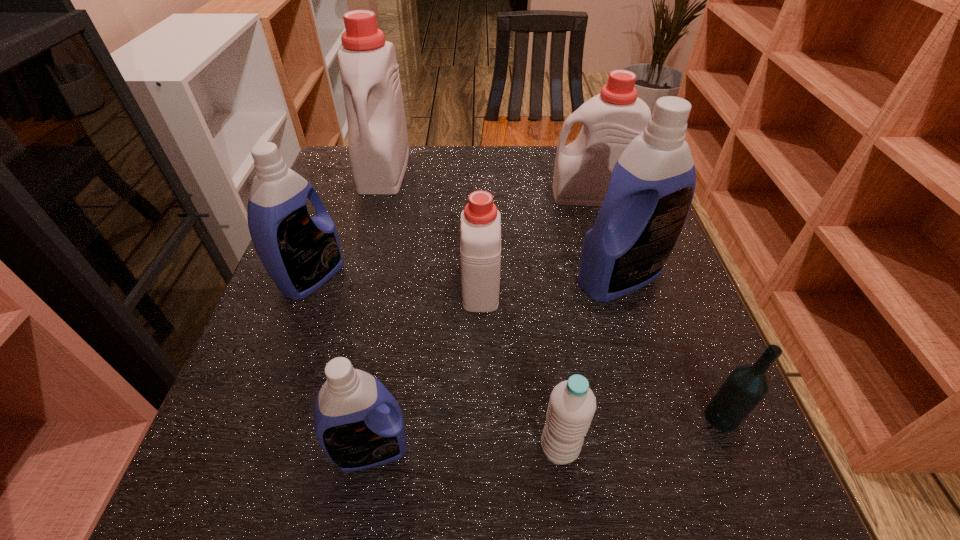
This screenshot has width=960, height=540. I want to click on vacant area at the left edge of the desktop, so click(315, 350).

Locate an element on the screen. vacant space at the right edge of the desktop is located at coordinates (652, 306).

Identify the location of vacant space at the far left corner of the desktop. (334, 176).

Image resolution: width=960 pixels, height=540 pixels. I want to click on vacant point located between the rightmost white detergent and the fourth object from left to right, so click(x=536, y=240).

The width and height of the screenshot is (960, 540). Find the location of `vacant point located between the nearest white detergent and the black vodka`. vacant point located between the nearest white detergent and the black vodka is located at coordinates point(601,351).

Where is `free space between the fifth object from right to left and the leftmost blue detergent`? The width and height of the screenshot is (960, 540). free space between the fifth object from right to left and the leftmost blue detergent is located at coordinates (396, 281).

At what (x,y) coordinates should I click in order to perform the action: click on vacant area that lies between the leftmost white detergent and the smallest blue detergent. Please return your answer as a coordinate pair (x, y). This screenshot has height=540, width=960. Looking at the image, I should click on (377, 309).

This screenshot has width=960, height=540. What are the coordinates of `free space between the second blue detergent from right to left and the fourth object from left to right` in the screenshot? It's located at (426, 367).

Locate an element on the screen. free area in between the rightmost blue detergent and the nearest blue detergent is located at coordinates (495, 363).

Locate an element on the screen. This screenshot has height=540, width=960. empty space that is in between the second blue detergent from right to left and the smallest white detergent is located at coordinates (426, 367).